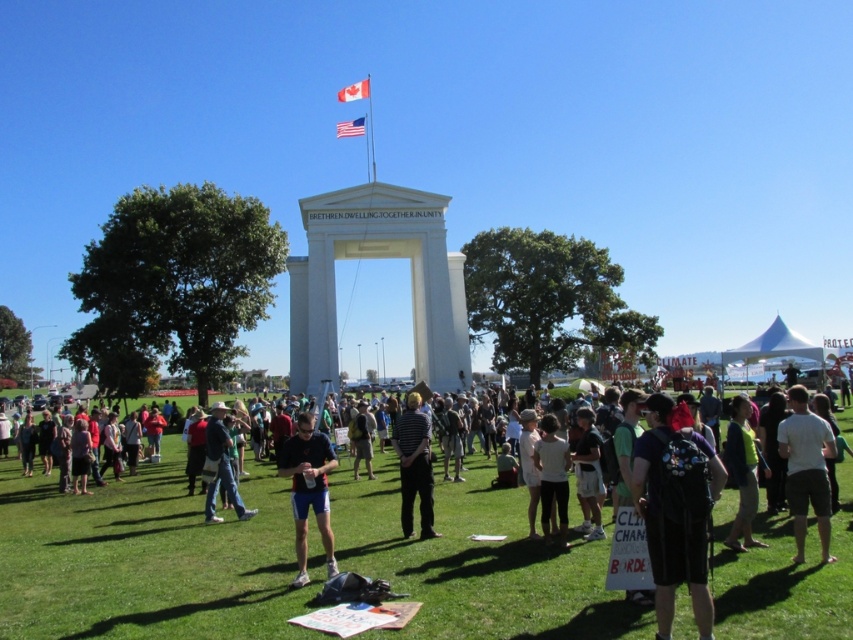
Is white cotton shirt at lower right shorter than green fabric jacket at lower right?

Incorrect, white cotton shirt at lower right's height does not fall short of green fabric jacket at lower right's.

Is white cotton shirt at lower right positioned at the back of green fabric jacket at lower right?

That is False.

Find the location of `white cotton shirt at lower right`. white cotton shirt at lower right is located at coordinates (805, 468).

Does white cotton shirt at lower right appear over white cotton shirt at center?

Correct, white cotton shirt at lower right is located above white cotton shirt at center.

Is white cotton shirt at lower right shorter than white cotton shirt at center?

Incorrect, white cotton shirt at lower right's height does not fall short of white cotton shirt at center's.

Measure the distance between point (828, 432) and camera.

Point (828, 432) is 229.19 feet away from camera.

This screenshot has height=640, width=853. I want to click on white cotton shirt at lower right, so click(805, 468).

Looking at this image, is dark blue t-shirt at center wider than striped shirt at center?

Correct, the width of dark blue t-shirt at center exceeds that of striped shirt at center.

Between point (281, 474) and point (432, 476), which one is positioned in front?

Point (281, 474) is in front.

Find the location of `dark blue t-shirt at center`. dark blue t-shirt at center is located at coordinates (308, 490).